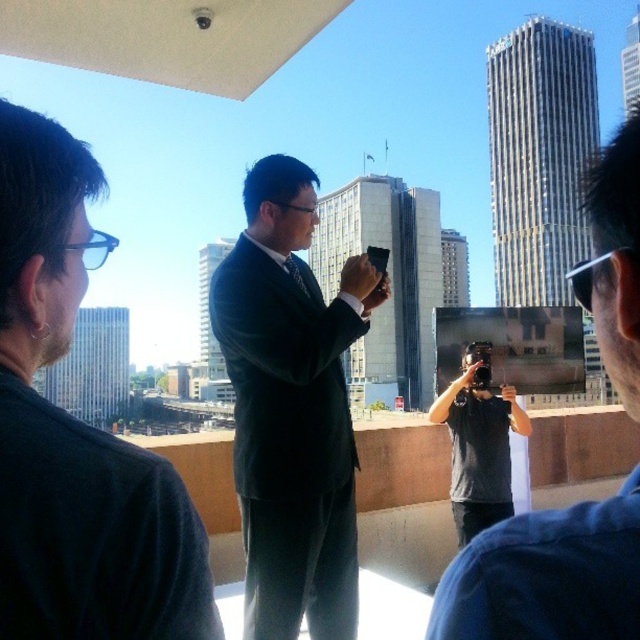
You are a photographer trying to capture a group photo of the black matte suit at center and the dark blue suit at center. Which one should you focus on first if you want to ensure both are in frame without moving the camera?

The black matte suit at center has a larger size compared to dark blue suit at center, so you should focus on the black matte suit at center first to ensure both fit within the frame.

Consider the image. You are a drone operator tasked with capturing aerial footage of the scene. The drone has a minimum safe operating distance of 25 meters to avoid interference with people. Based on the image, can you safely fly the drone over the area where the dark gray shirt at center and the gray fabric camera at center are located?

The distance between the dark gray shirt at center and the gray fabric camera at center is 24.43 meters, which is less than the drone operator requires to maintain a minimum safe operating distance of 25 meters. Therefore, it is not safe to fly the drone over that area.

You are a photographer trying to capture a clear shot of the city skyline. You notice two items in the foreground, the dark gray shirt at center and the gray fabric camera at center. Which item is blocking your view of the camera?

The dark gray shirt at center is blocking the view of the gray fabric camera at center because it is positioned in front of it.